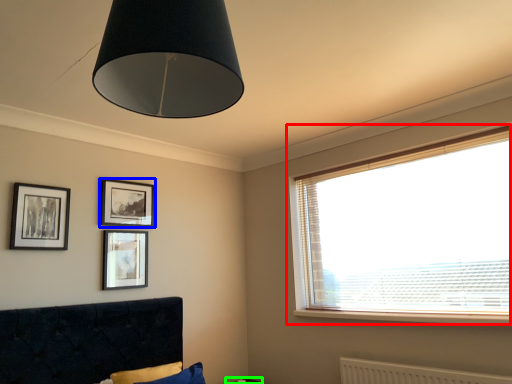
Question: Based on their relative distances, which object is farther from window (highlighted by a red box)? Choose from picture frame (highlighted by a blue box) and table (highlighted by a green box).

Choices:
 (A) picture frame
 (B) table

Answer: (A)